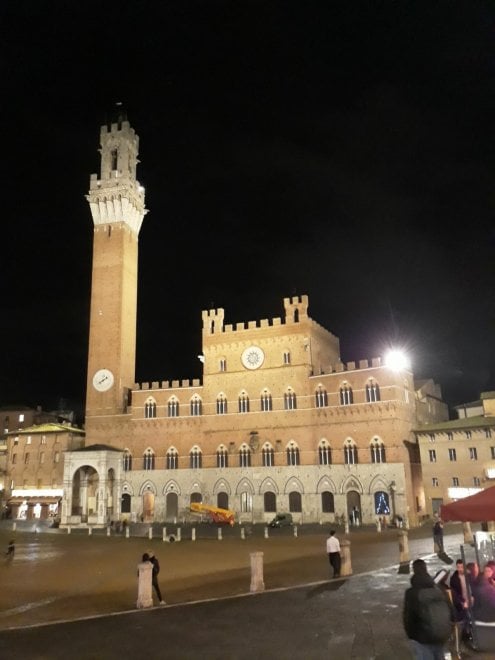
Where is `top arch of doorway`? This screenshot has height=660, width=495. top arch of doorway is located at coordinates (85, 465).